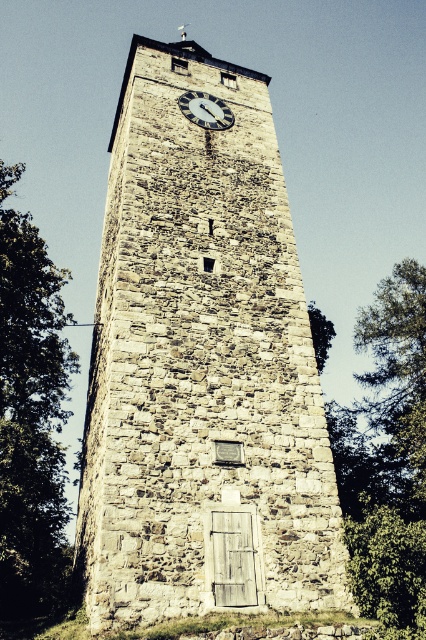
You are a maintenance worker needing to reach both the stone clock tower at center and the white stone clock at upper center for repairs. The ladder you have can only extend to 12 meters. Can you reach both objects with the ladder without moving it?

The stone clock tower at center and the white stone clock at upper center are 12.15 meters apart from each other. Since the ladder can only extend to 12 meters, it is not long enough to reach both objects without moving it.

You are standing in front of the tower and want to find the tree that is closer to the ground. Which one is it between the green leafy tree at right and the green leafy tree at center?

The green leafy tree at right is located below the green leafy tree at center, so it is closer to the ground.

You are standing in front of the stone clock tower at center and the green leafy tree at left. Which object is positioned higher in the image?

The stone clock tower at center is positioned higher than the green leafy tree at left according to the description.